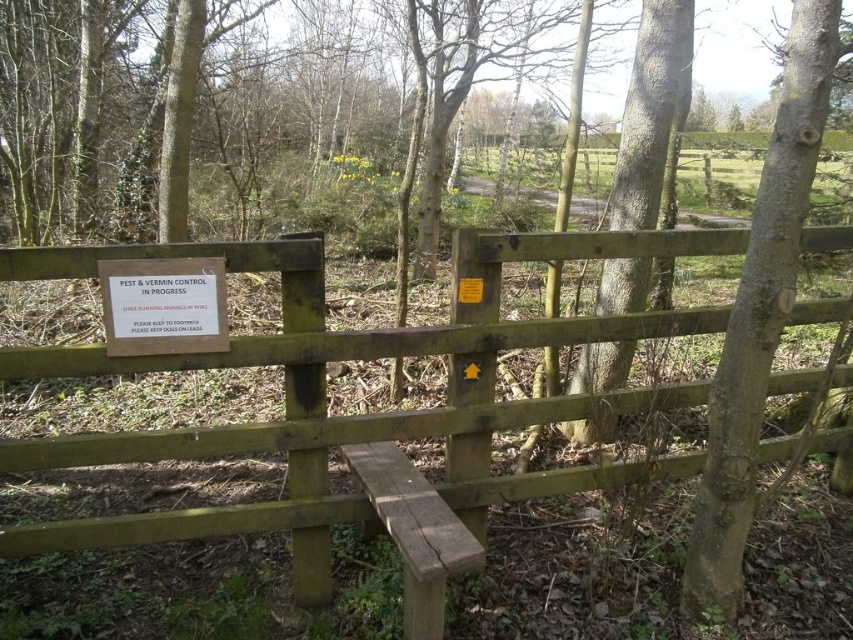
Question: From the image, what is the correct spatial relationship of rough bark tree at center in relation to white paper sign at center?

Choices:
 (A) right
 (B) left

Answer: (A)

Question: Which point is farther to the camera?

Choices:
 (A) (120, 531)
 (B) (108, 323)
 (C) (769, 342)
 (D) (390, 525)

Answer: (A)

Question: Does green wooden fence at center appear over white paper sign at center?

Choices:
 (A) yes
 (B) no

Answer: (B)

Question: Which of the following is the farthest from the observer?

Choices:
 (A) white paper sign at center
 (B) green wooden fence at center

Answer: (A)

Question: Which point is farther to the camera?

Choices:
 (A) (752, 502)
 (B) (460, 564)
 (C) (123, 273)

Answer: (A)

Question: Is green wooden fence at center wider than white paper sign at center?

Choices:
 (A) yes
 (B) no

Answer: (A)